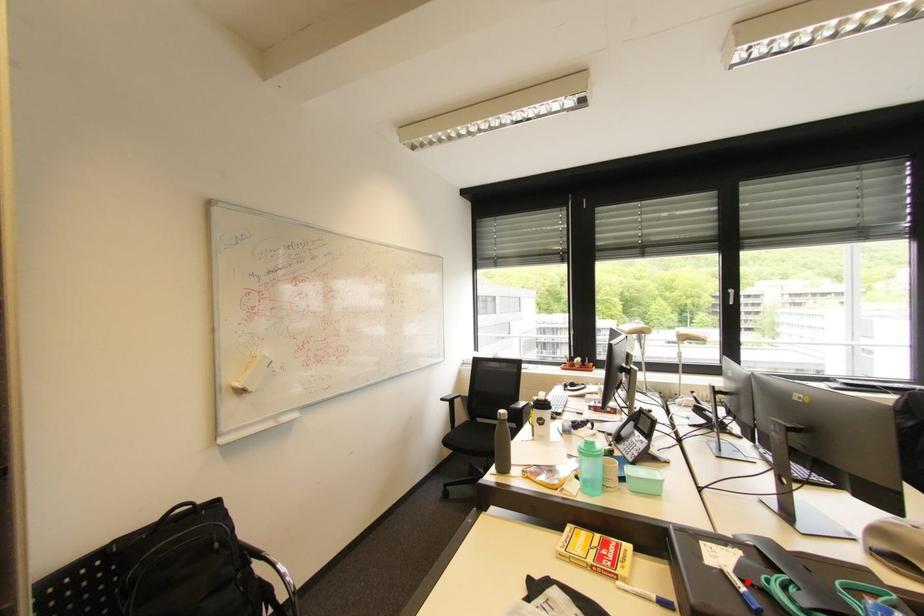
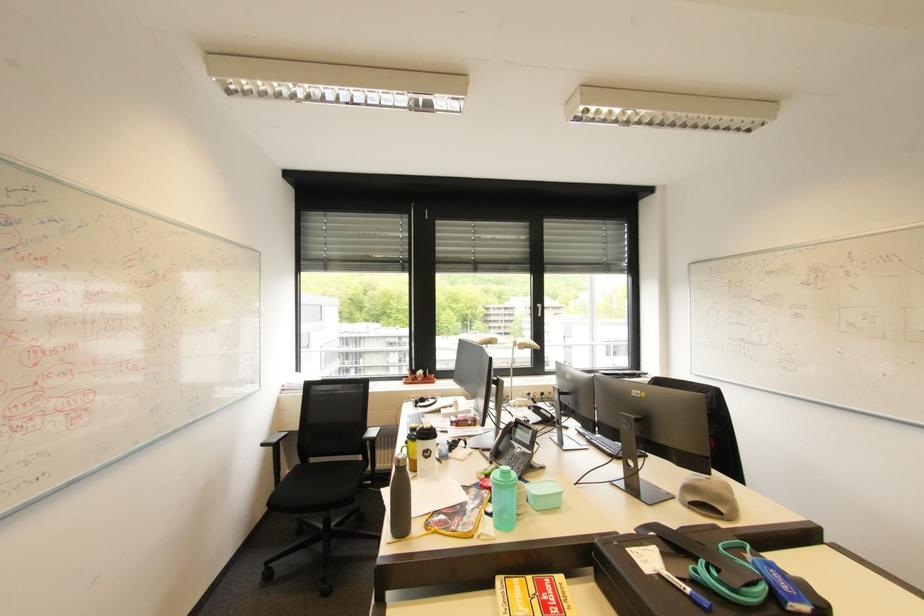
The point at the highlighted location is marked in the first image. Where is the corresponding point in the second image?

(685, 581)